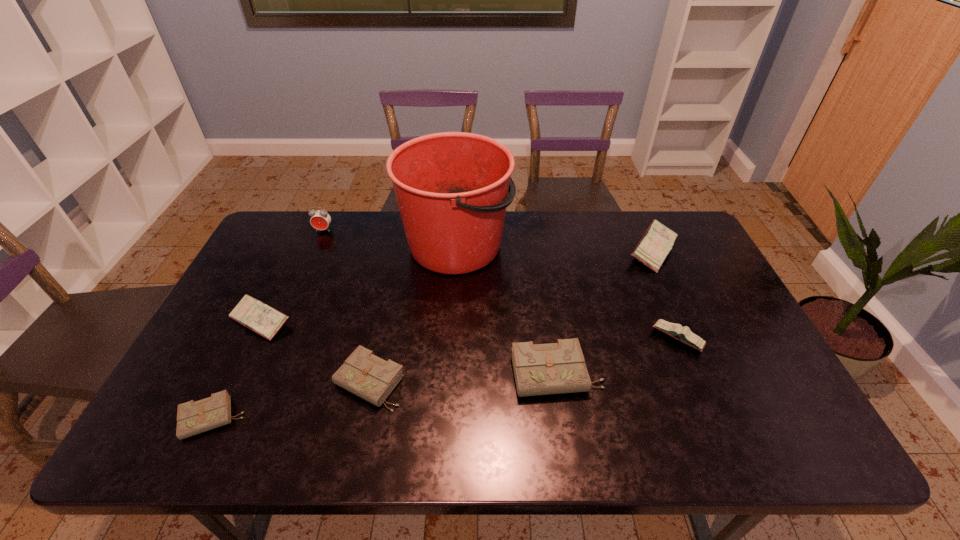
Select which green diary is the second closest to the second biggest pink diary. Please provide its 2D coordinates. Your answer should be formatted as a tuple, i.e. [(x, y)], where the tuple contains the x and y coordinates of a point satisfying the conditions above.

[(371, 378)]

At what (x,y) coordinates should I click in order to perform the action: click on green diary that can be found as the third closest to the second biggest pink diary. Please return your answer as a coordinate pair (x, y). The height and width of the screenshot is (540, 960). Looking at the image, I should click on (555, 368).